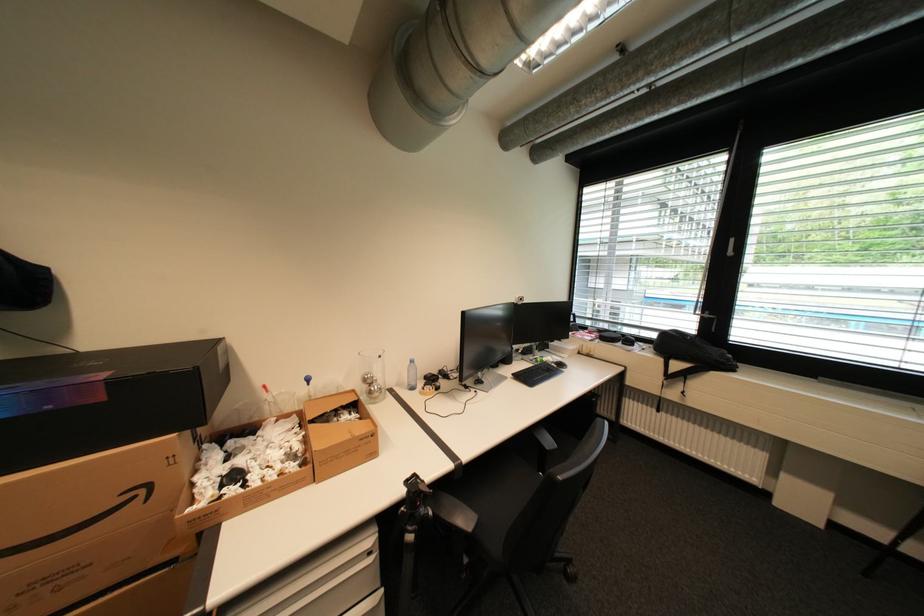
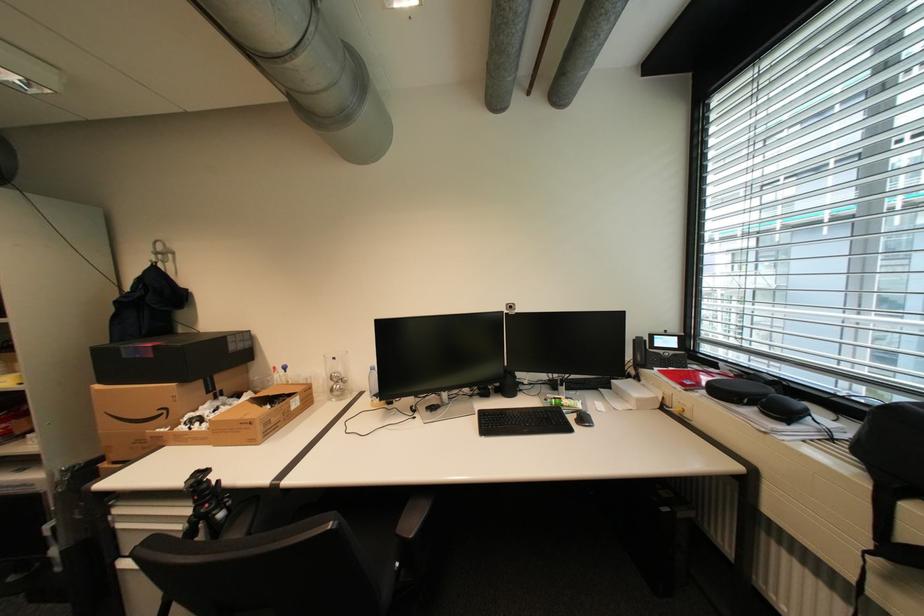
The point at (151, 491) is marked in the first image. Where is the corresponding point in the second image?

(174, 411)